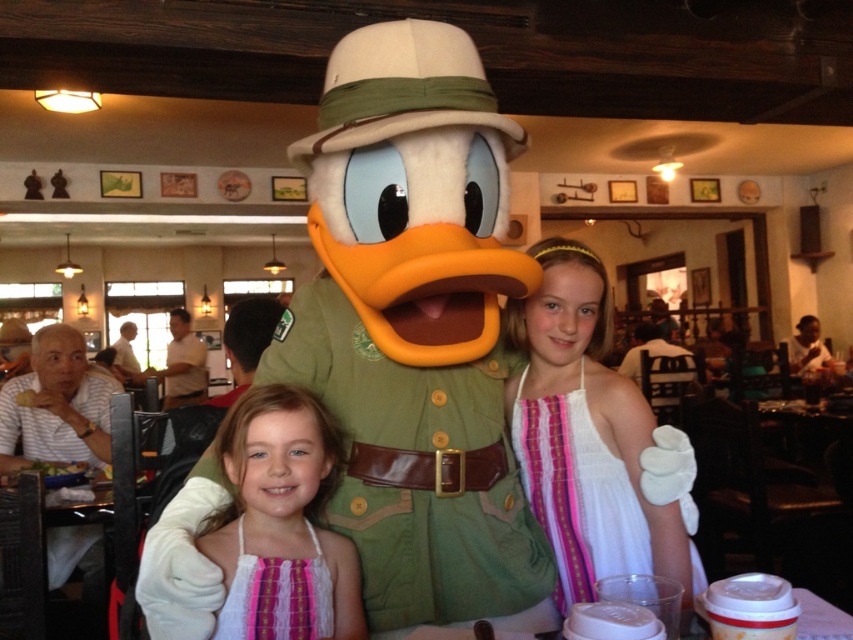
You are standing at the point with coordinates point (241, 573) and want to move to the point with coordinates point (579, 588). Is the destination point behind you or in front of you?

The point (579, 588) is behind point (241, 573), so the destination point is behind you.

You are a photographer trying to capture a clear shot of the Donald Duck character and the two girls. The white sheer dress at center and the translucent plastic cups at lower center are in the frame. Which object should you focus on to ensure the Donald Duck character is in focus?

The white sheer dress at center is much taller than the translucent plastic cups at lower center, so focusing on the white sheer dress at center would ensure the Donald Duck character is in focus since it is closer to the same plane as the character.

You are a photographer at the restaurant and need to decide which dress to focus on for a closeup shot. Since the white sheer dress at center and the pink woven dress at center are both at the center, which one would you choose if you want to capture the larger one?

The white sheer dress at center has a larger size compared to the pink woven dress at center, so you should focus on the white sheer dress at center for the closeup shot.